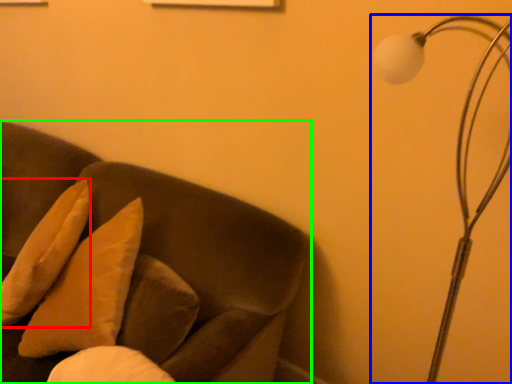
Question: Based on their relative distances, which object is farther from pillow (highlighted by a red box)? Choose from lamp (highlighted by a blue box) and furniture (highlighted by a green box).

Choices:
 (A) lamp
 (B) furniture

Answer: (A)